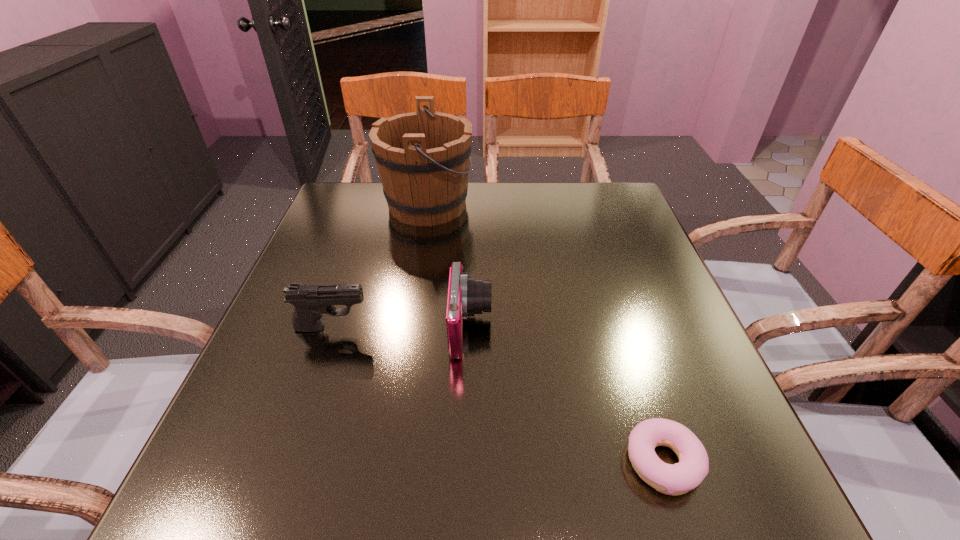
Image resolution: width=960 pixels, height=540 pixels. I want to click on the tallest object, so click(423, 157).

Locate an element on the screen. The width and height of the screenshot is (960, 540). wine bucket is located at coordinates (423, 157).

Locate an element on the screen. The width and height of the screenshot is (960, 540). pistol is located at coordinates (310, 301).

Where is `camera`? The width and height of the screenshot is (960, 540). camera is located at coordinates (467, 295).

You are a GUI agent. You are given a task and a screenshot of the screen. Output one action in this format:
    pyautogui.click(x=<x>, y=<y>)
    Task: Click on the shortest object
    
    Given the screenshot: What is the action you would take?
    pyautogui.click(x=675, y=479)

Image resolution: width=960 pixels, height=540 pixels. I want to click on the rightmost object, so click(x=675, y=479).

At what (x,y) coordinates should I click in order to perform the action: click on vacant space situated on the side of the tallest object with the handle for carrying. Please return your answer as a coordinate pair (x, y). The width and height of the screenshot is (960, 540). Looking at the image, I should click on (613, 205).

This screenshot has height=540, width=960. I want to click on free space located 0.190m at the barrel of the pistol, so click(466, 327).

You are a GUI agent. You are given a task and a screenshot of the screen. Output one action in this format:
    pyautogui.click(x=<x>, y=<y>)
    Task: Click on the vacant space situated on the front-facing side of the camera
    
    Given the screenshot: What is the action you would take?
    pyautogui.click(x=567, y=328)

What are the coordinates of `vacant space situated on the back of the doughnut` in the screenshot? It's located at (615, 316).